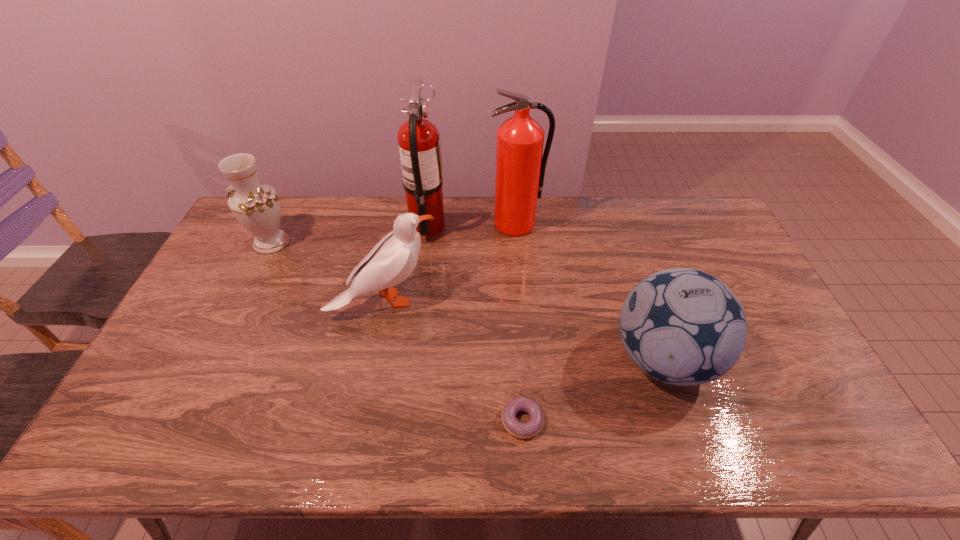
In order to click on free location at the left edge in this screenshot , I will do `click(219, 306)`.

This screenshot has width=960, height=540. In the image, there is a desktop. In order to click on free space at the right edge in this screenshot , I will do [x=805, y=390].

Where is `free space at the far left corner`? This screenshot has height=540, width=960. free space at the far left corner is located at coordinates (249, 234).

Where is `free space at the near left corner`? This screenshot has height=540, width=960. free space at the near left corner is located at coordinates (165, 426).

Where is `vacant region at the far right corner of the desktop`? vacant region at the far right corner of the desktop is located at coordinates (686, 207).

Identify the location of free space between the left fire extinguisher and the rightmost object. The width and height of the screenshot is (960, 540). [x=545, y=293].

The width and height of the screenshot is (960, 540). Find the location of `vacant area between the left fire extinguisher and the shortest object`. vacant area between the left fire extinguisher and the shortest object is located at coordinates (475, 323).

This screenshot has width=960, height=540. In order to click on free space between the left fire extinguisher and the doughnut in this screenshot , I will do `click(475, 323)`.

This screenshot has width=960, height=540. Identify the location of vacant space that is in between the doughnut and the vase. (396, 332).

Locate an element on the screen. This screenshot has width=960, height=540. free spot between the left fire extinguisher and the soccer ball is located at coordinates (545, 293).